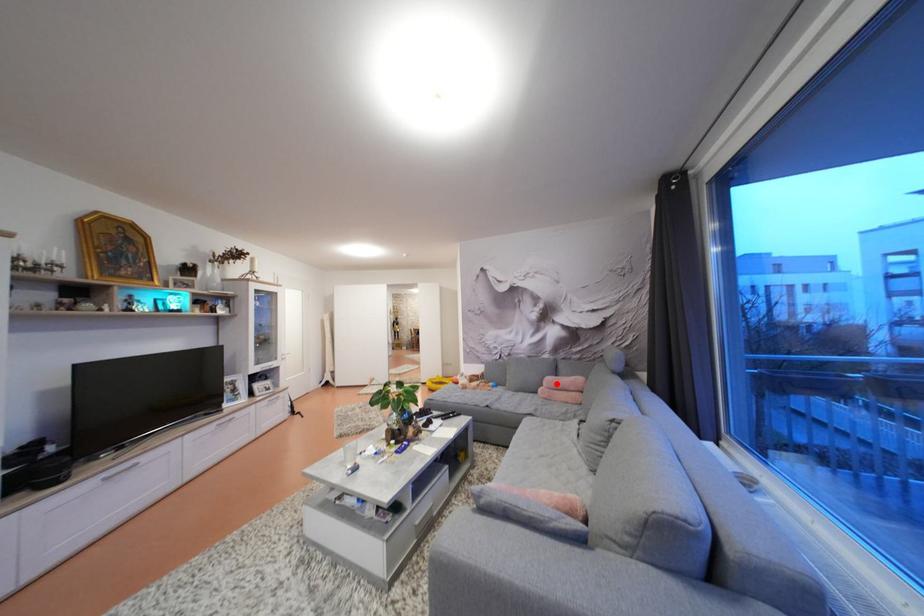
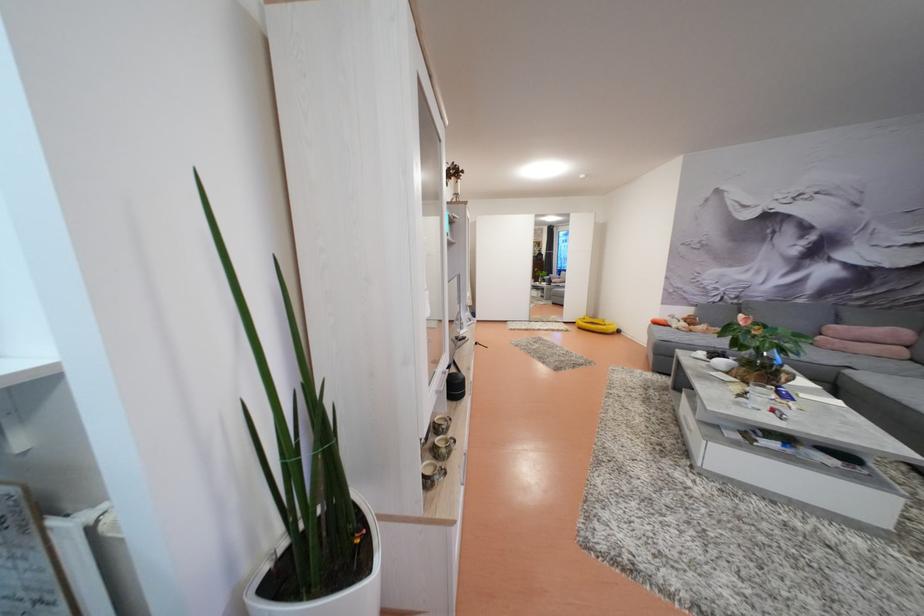
Question: I am providing you with two images of the same scene from different viewpoints. A red point is shown in image1. For the corresponding object point in image2, is it positioned nearer or farther from the camera?

Choices:
 (A) Nearer
 (B) Farther

Answer: (A)